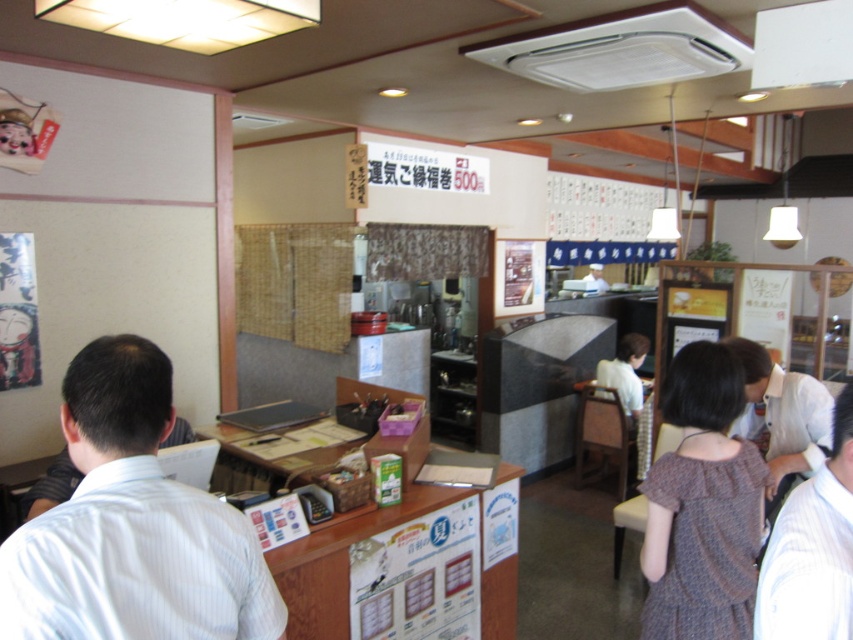
Is white shirt at right wider than white uniform at center?

In fact, white shirt at right might be narrower than white uniform at center.

Can you confirm if white shirt at right is shorter than white uniform at center?

No.

Measure the distance between white shirt at right and camera.

white shirt at right and camera are 3.42 feet apart from each other.

Where is `white shirt at right`? This screenshot has width=853, height=640. white shirt at right is located at coordinates (811, 548).

Is white striped shirt at left closer to camera compared to white shirt at right?

Yes.

Is white striped shirt at left behind white shirt at right?

No, it is in front of white shirt at right.

Is point (219, 586) closer to viewer compared to point (802, 509)?

Yes, it is.

This screenshot has width=853, height=640. I want to click on white striped shirt at left, so click(132, 525).

Is brown textured dress at center thinner than white shirt at right?

Incorrect, brown textured dress at center's width is not less than white shirt at right's.

Is point (657, 570) behind point (838, 468)?

That is True.

Who is more forward, (734, 620) or (790, 550)?

Positioned in front is point (790, 550).

Locate an element on the screen. brown textured dress at center is located at coordinates (701, 506).